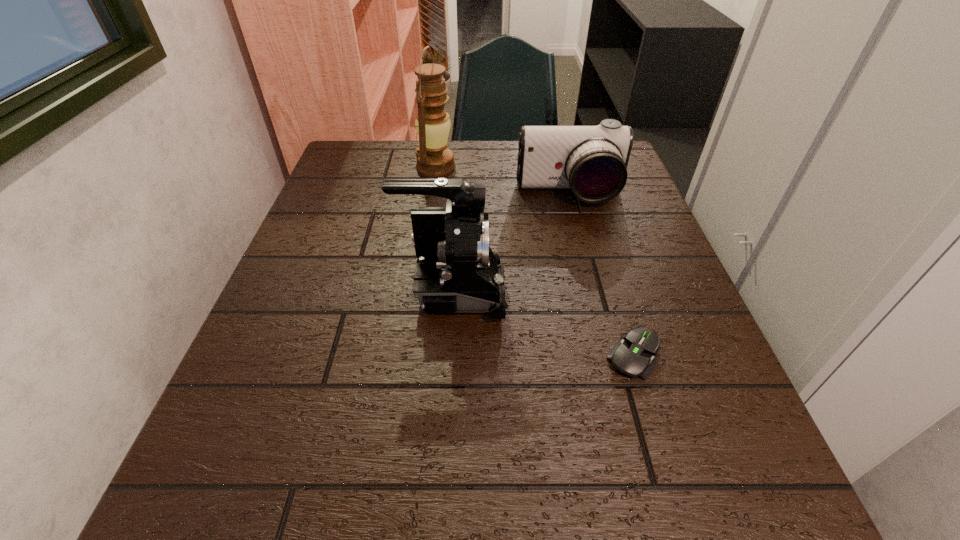
Identify the location of vacant space that satisfies the following two spatial constraints: 1. on the back side of the nearest object; 2. on the lens mount of the taller camcorder. (614, 292).

Where is `free space that satisfies the following two spatial constraints: 1. on the front side of the nearest object; 2. on the right side of the tallest object`? free space that satisfies the following two spatial constraints: 1. on the front side of the nearest object; 2. on the right side of the tallest object is located at coordinates (410, 355).

Find the location of a particular element. Image resolution: width=960 pixels, height=540 pixels. free point that satisfies the following two spatial constraints: 1. on the surface of the shorter camcorder; 2. on the right side of the nearest object is located at coordinates (611, 355).